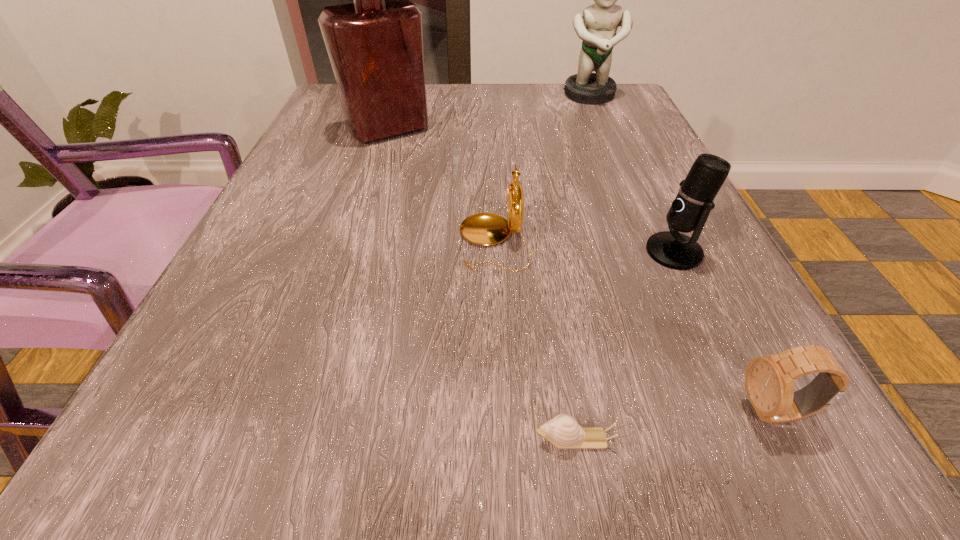
Identify the location of liquor. (375, 45).

This screenshot has height=540, width=960. In order to click on the second farthest object in this screenshot , I will do `click(375, 45)`.

At what (x,y) coordinates should I click in order to perform the action: click on the farthest object. Please return your answer as a coordinate pair (x, y). The height and width of the screenshot is (540, 960). Looking at the image, I should click on (597, 27).

At what (x,y) coordinates should I click in order to perform the action: click on figurine. Please return your answer as a coordinate pair (x, y). Looking at the image, I should click on (597, 27).

Locate an element on the screen. This screenshot has height=540, width=960. microphone is located at coordinates (689, 211).

Where is `pocket watch`? pocket watch is located at coordinates (485, 229).

Where is `watch`? The image size is (960, 540). watch is located at coordinates (769, 381).

Where is `the shortest object`? the shortest object is located at coordinates (563, 431).

This screenshot has height=540, width=960. What are the coordinates of `free space located on the right of the tallest object` in the screenshot? It's located at (472, 130).

I want to click on free space located 0.330m on the front-facing side of the farthest object, so click(x=629, y=188).